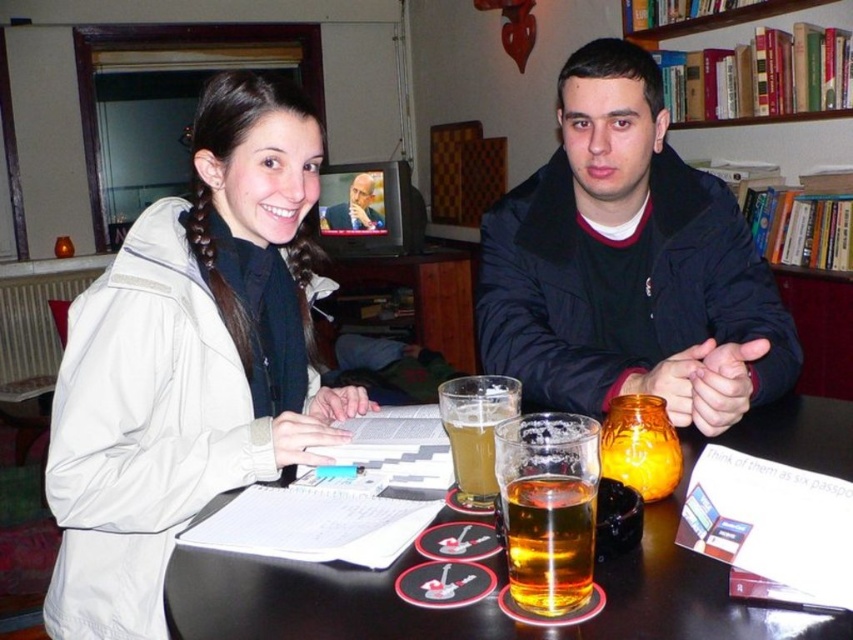
Question: Among these objects, which one is farthest from the camera?

Choices:
 (A) translucent amber liquid at table center
 (B) black plastic table at center

Answer: (A)

Question: Can you confirm if black plastic table at center is positioned above smooth skin face at center?

Choices:
 (A) no
 (B) yes

Answer: (A)

Question: Which of the following is the closest to the observer?

Choices:
 (A) translucent amber liquid at table center
 (B) black plastic table at center
 (C) translucent glass beer at center

Answer: (B)

Question: Which point is farther to the camera?

Choices:
 (A) white matte jacket at upper left
 (B) translucent amber liquid at table center
 (C) black plastic table at center
 (D) smooth skin face at center

Answer: (D)

Question: Considering the relative positions of white matte jacket at upper left and translucent glass beer at center in the image provided, where is white matte jacket at upper left located with respect to translucent glass beer at center?

Choices:
 (A) right
 (B) left

Answer: (B)

Question: Can you confirm if dark blue jacket at center is positioned to the right of smooth skin face at center?

Choices:
 (A) no
 (B) yes

Answer: (B)